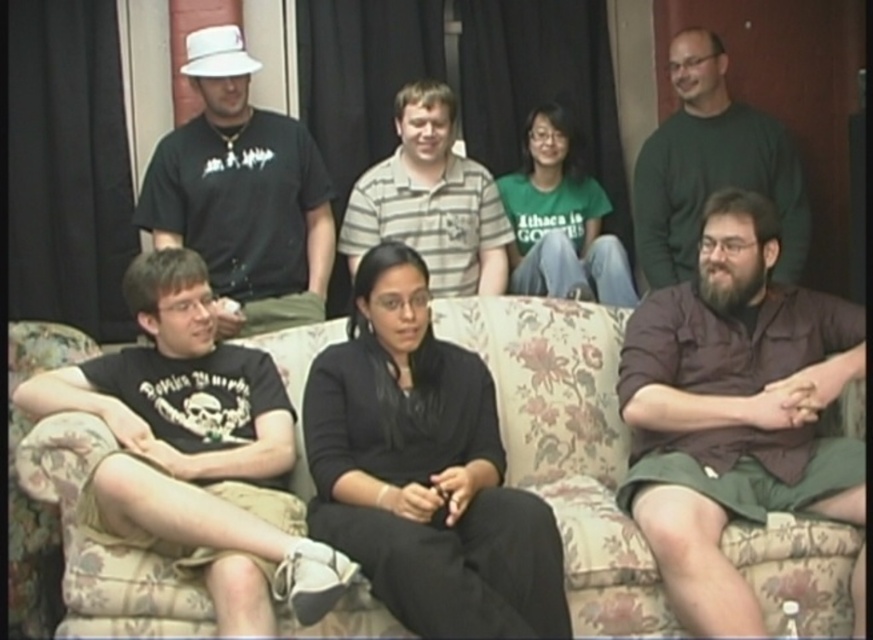
You are trying to decide whether to place a small decorative pillow on the floral fabric couch at center or the dark green sweater at upper right. Based on their heights, which location would be more stable for the pillow?

The floral fabric couch at center is shorter than the dark green sweater at upper right, so placing the pillow on the floral fabric couch at center would provide a more stable base since it is lower and less likely to topple over.

You are standing in the room and notice the black matte dress at center. Can you determine its exact location based on the coordinates provided in the scene description?

The black matte dress at center is located at point (424, 470) according to the scene description.